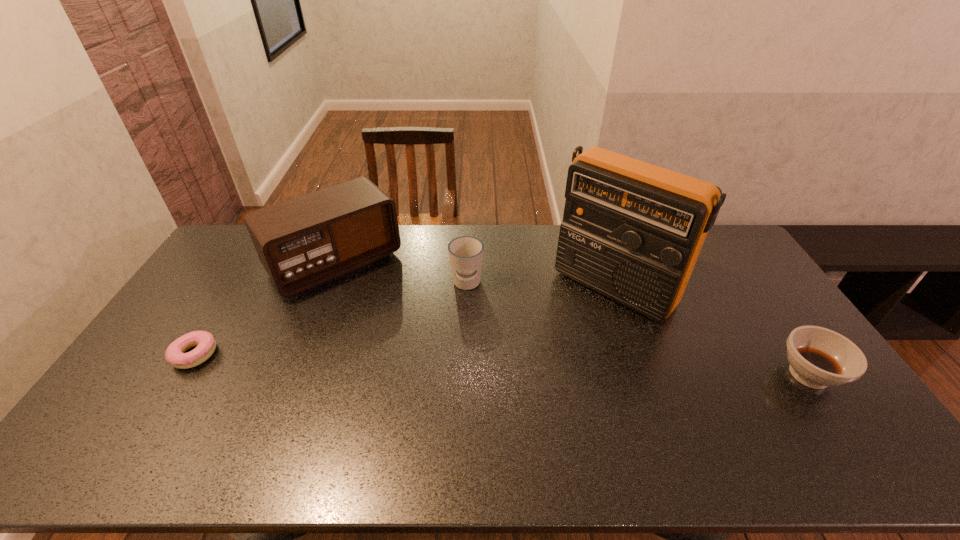
The height and width of the screenshot is (540, 960). I want to click on vacant point located on the front-facing side of the shorter radio receiver, so pos(383,317).

Where is `object that is at the near edge`? The width and height of the screenshot is (960, 540). object that is at the near edge is located at coordinates tap(819, 357).

Where is `object located in the left edge section of the desktop`? Image resolution: width=960 pixels, height=540 pixels. object located in the left edge section of the desktop is located at coordinates (175, 354).

Locate an element on the screen. object situated at the right edge is located at coordinates (819, 357).

The height and width of the screenshot is (540, 960). What are the coordinates of `object present at the near right corner` in the screenshot? It's located at (819, 357).

This screenshot has width=960, height=540. In the image, there is a desktop. In order to click on vacant space at the far edge in this screenshot , I will do `click(555, 243)`.

Locate an element on the screen. Image resolution: width=960 pixels, height=540 pixels. free region at the near edge of the desktop is located at coordinates (553, 408).

I want to click on free region at the left edge, so click(x=232, y=281).

Identify the location of vacant point at the right edge. (764, 359).

Where is `vacant area at the far right corner`? This screenshot has width=960, height=540. vacant area at the far right corner is located at coordinates tap(719, 239).